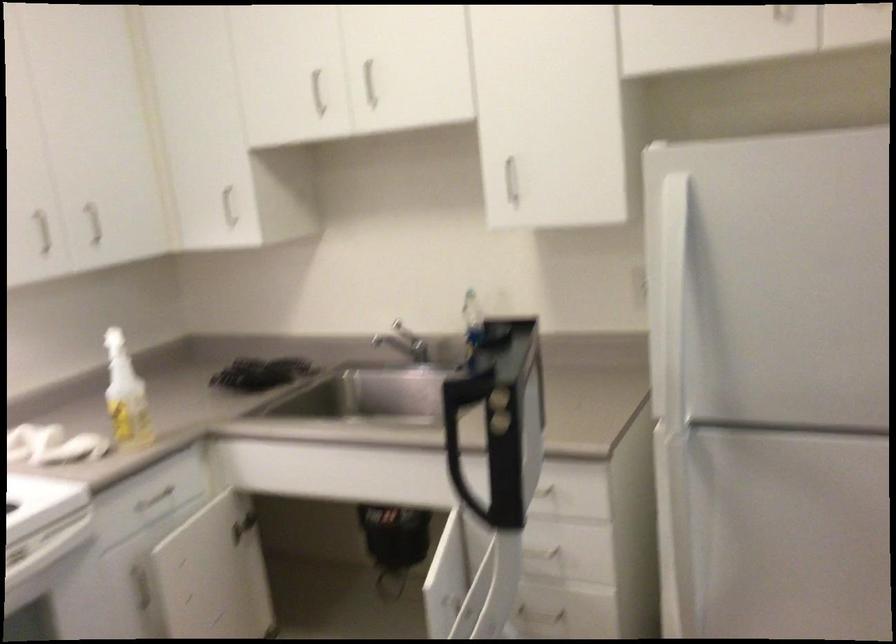
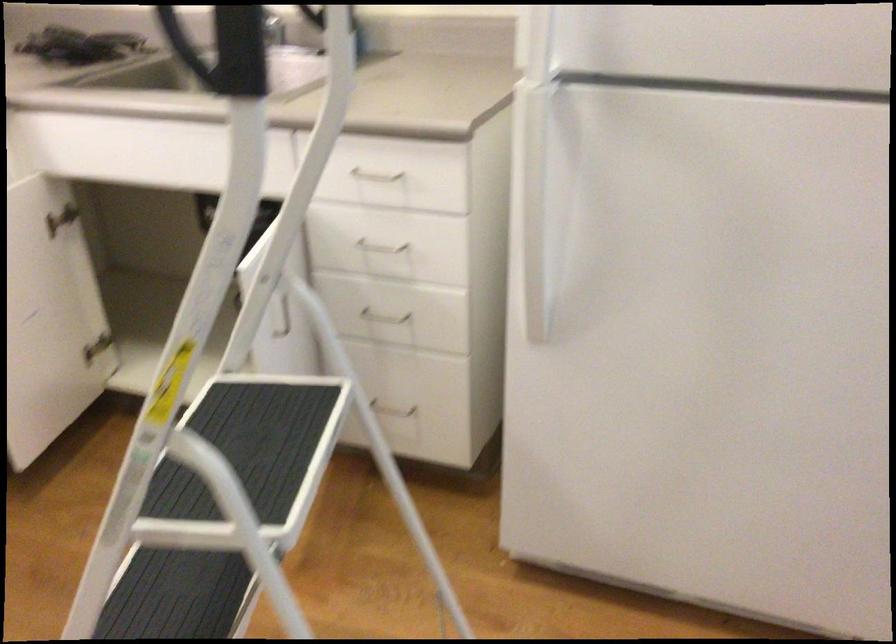
The images are taken continuously from a first-person perspective. In which direction are you moving?

The cameraman moved toward right, forward.